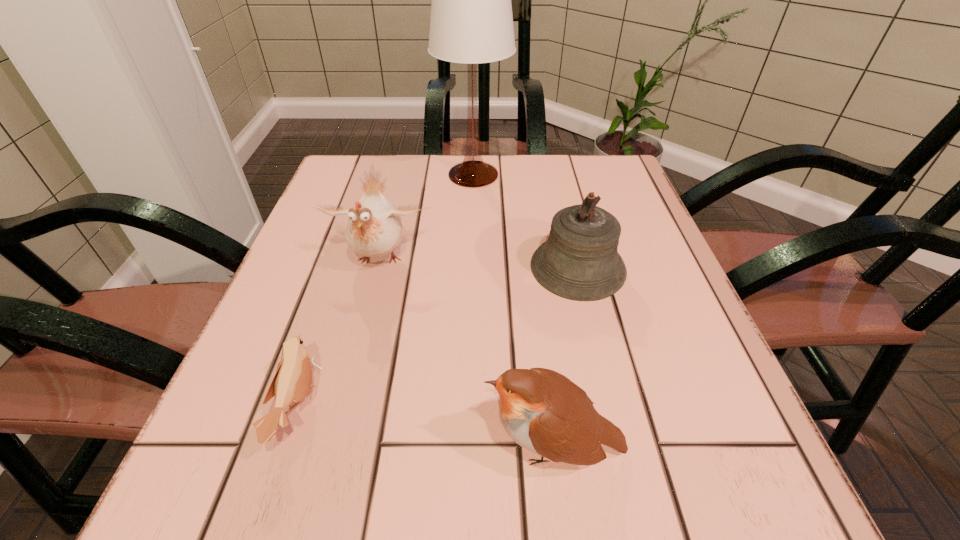
At what (x,y) coordinates should I click in order to perform the action: click on unoccupied area between the bell and the tallest object. Please return your answer as a coordinate pair (x, y). This screenshot has height=540, width=960. Looking at the image, I should click on (526, 221).

This screenshot has width=960, height=540. Find the location of `vacant space that's between the rightmost bird and the bell`. vacant space that's between the rightmost bird and the bell is located at coordinates (566, 357).

The height and width of the screenshot is (540, 960). Find the location of `object that stands as the third closest to the rightmost bird`. object that stands as the third closest to the rightmost bird is located at coordinates (374, 229).

You are a GUI agent. You are given a task and a screenshot of the screen. Output one action in this format:
    pyautogui.click(x=<x>, y=<y>)
    Task: Click on the second closest object to the shortest bird
    
    Given the screenshot: What is the action you would take?
    pos(543,411)

I want to click on bird that is the closest to the table lamp, so click(x=374, y=229).

This screenshot has height=540, width=960. I want to click on bird that stands as the closest to the rightmost bird, so click(292, 381).

Find the location of a particular element. vacant space that satisfies the following two spatial constraints: 1. above the cylindrical shade of the bell; 2. on the left side of the table lamp is located at coordinates (471, 268).

Where is `free location that satisfies the following two spatial constraints: 1. at the beak of the farthest bird; 2. at the beak of the shortest object`? free location that satisfies the following two spatial constraints: 1. at the beak of the farthest bird; 2. at the beak of the shortest object is located at coordinates (342, 407).

At what (x,y) coordinates should I click in order to perform the action: click on vacant region that satisfies the following two spatial constraints: 1. above the cylindrical shade of the farthest object; 2. on the back side of the bell. Please return your answer as a coordinate pair (x, y). The image size is (960, 540). Looking at the image, I should click on (471, 268).

You are a GUI agent. You are given a task and a screenshot of the screen. Output one action in this format:
    pyautogui.click(x=<x>, y=<y>)
    Task: Click on the vacant space that satisfies the following two spatial constraints: 1. above the cylindrical shade of the farthest object; 2. on the right side of the bell
    The width and height of the screenshot is (960, 540).
    Given the screenshot: What is the action you would take?
    pyautogui.click(x=471, y=268)